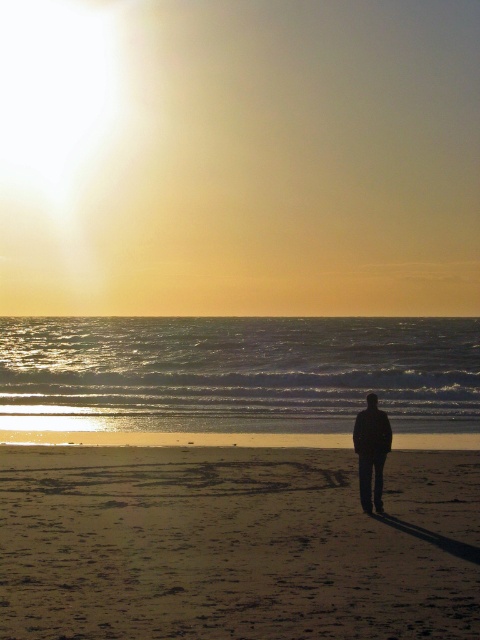
You are a photographer trying to capture the sunset at the beach. You want to place your tripod exactly where the smooth golden sand at center is located. According to the coordinates given, where should you set up your tripod?

You should set up your tripod at the coordinates point [214,548] where the smooth golden sand at center is located.

You are a photographer trying to capture the sunset. You notice the smooth golden sand at center and the black matte jacket at center in your frame. Which object appears taller in the photo?

The black matte jacket at center appears taller than the smooth golden sand at center in the photo.